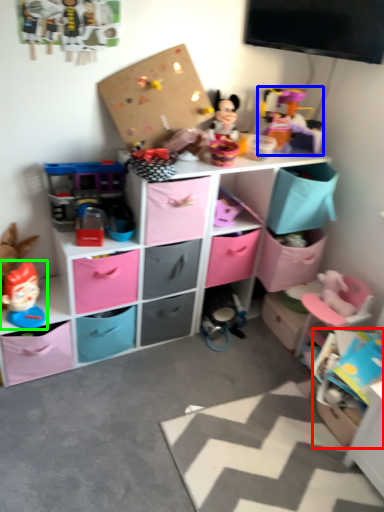
Question: Which is nearer to the storage box (highlighted by a red box)? toy (highlighted by a blue box) or toy (highlighted by a green box).

Choices:
 (A) toy
 (B) toy

Answer: (A)